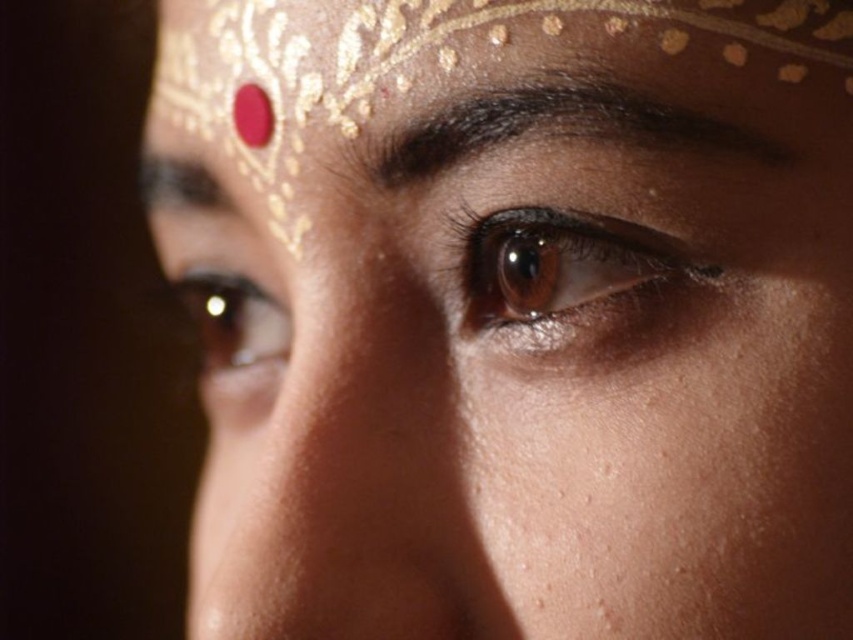
Question: Does gold textured forehead at upper center come in front of dark brown hair at upper center?

Choices:
 (A) yes
 (B) no

Answer: (A)

Question: Which is nearer to the brown matte eye at center?

Choices:
 (A) dark brown hair at upper center
 (B) brown shiny eye at center
 (C) gold textured forehead at upper center

Answer: (A)

Question: Observing the image, what is the correct spatial positioning of gold textured forehead at upper center in reference to brown shiny eye at center?

Choices:
 (A) left
 (B) right

Answer: (B)

Question: Can you confirm if brown matte eye at center is positioned above brown shiny eye at center?

Choices:
 (A) no
 (B) yes

Answer: (B)

Question: Among these points, which one is nearest to the camera?

Choices:
 (A) (x=422, y=168)
 (B) (x=564, y=220)

Answer: (B)

Question: Which point is closer to the camera?

Choices:
 (A) (386, 17)
 (B) (601, 116)
 (C) (461, 273)

Answer: (B)